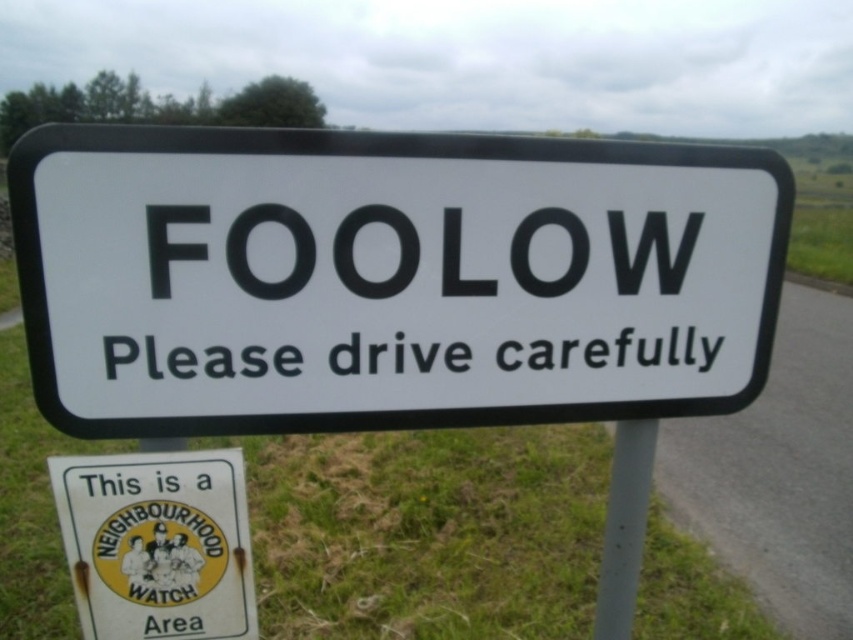
What object is located at the coordinates point (387, 278) in the image?

The point (387, 278) corresponds to the white plastic sign at center.

You are a driver approaching the road sign and need to read both the white plastic sign at center and the black matte text at center. Which one is bigger in size?

The white plastic sign at center has a larger size compared to the black matte text at center, so the white plastic sign at center is bigger.